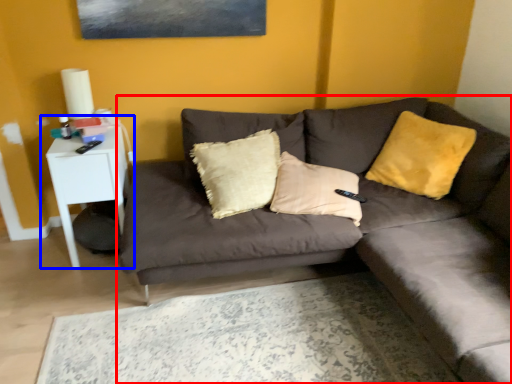
Question: Which point is further to the camera, studio couch (highlighted by a red box) or table (highlighted by a blue box)?

Choices:
 (A) studio couch
 (B) table

Answer: (B)